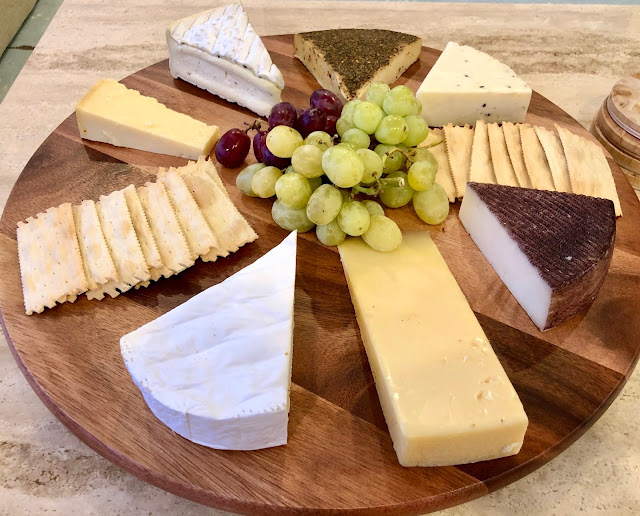
This screenshot has width=640, height=516. Find the location of `counter`. counter is located at coordinates (579, 68).